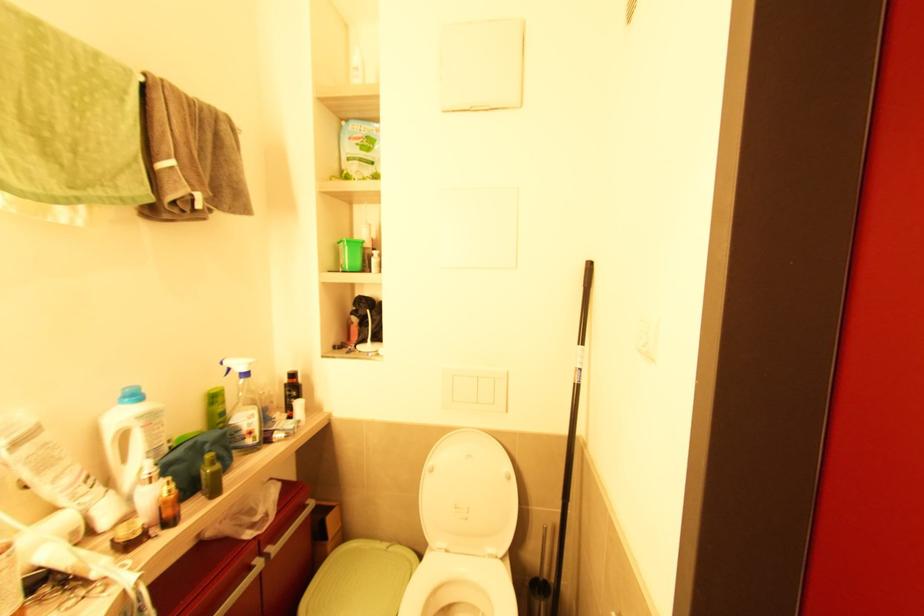
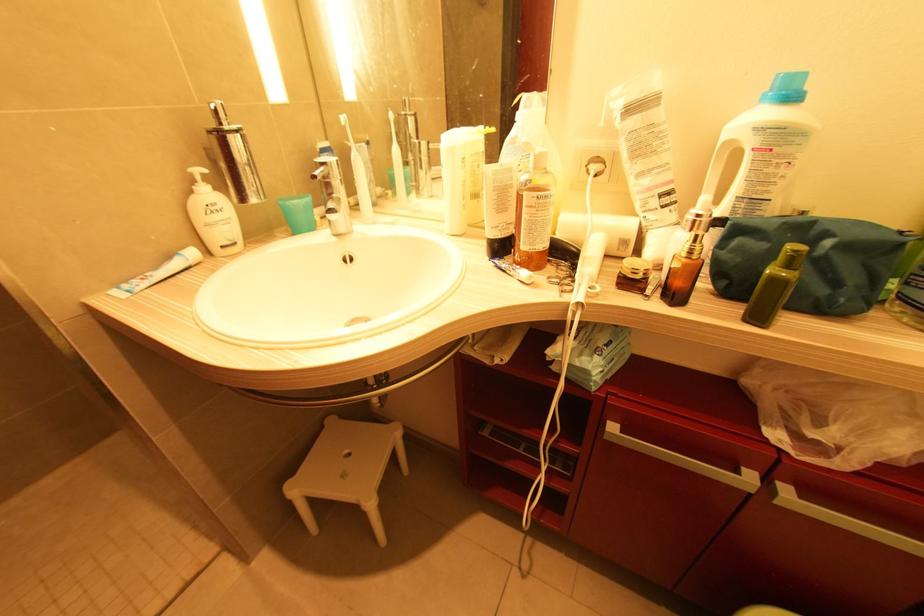
First-person continuous shooting, in which direction is the camera rotating?

The camera rotated toward left-down.